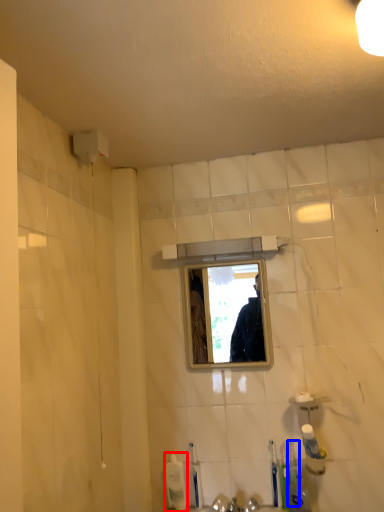
Question: Among these objects, which one is farthest to the camera, toiletry (highlighted by a red box) or toothbrush (highlighted by a blue box)?

Choices:
 (A) toiletry
 (B) toothbrush

Answer: (A)